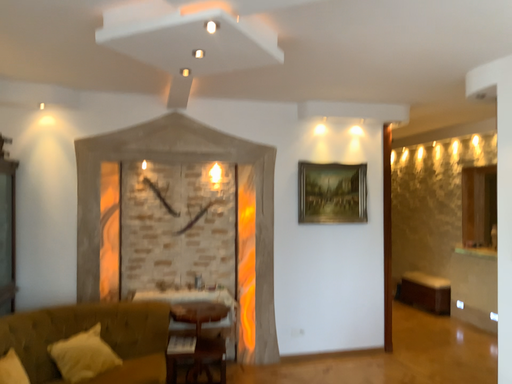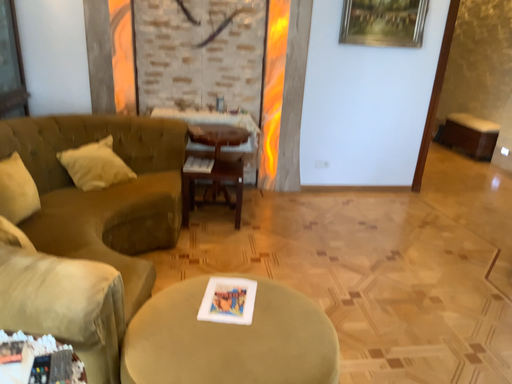
Question: Which way did the camera rotate in the video?

Choices:
 (A) rotated upward
 (B) rotated downward

Answer: (B)